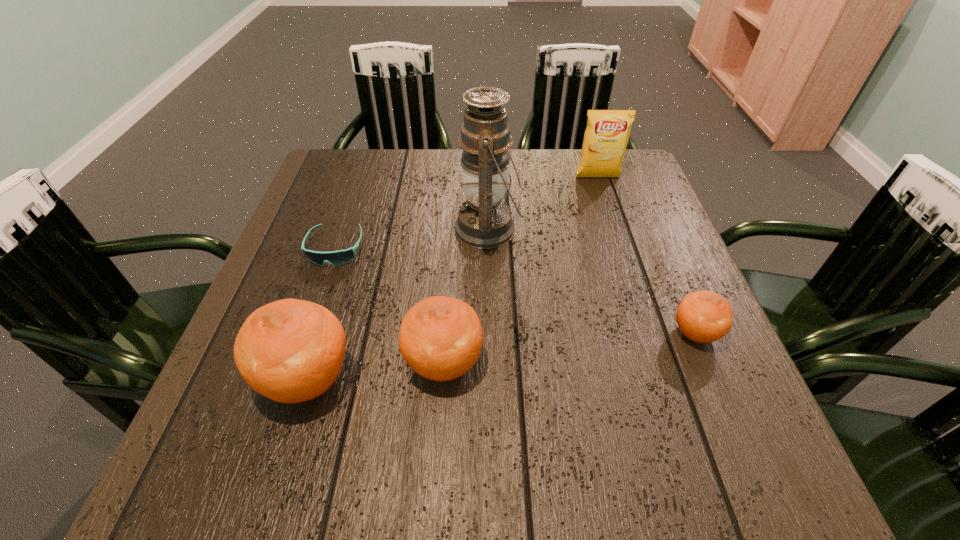
Find the location of a particular element. free location that satisfies the following two spatial constraints: 1. on the front-facing side of the leftmost orange; 2. on the right side of the shortest object is located at coordinates (291, 379).

Locate an element on the screen. free space that satisfies the following two spatial constraints: 1. on the front side of the rightmost orange; 2. on the left side of the tallest object is located at coordinates point(491,333).

I want to click on vacant point that satisfies the following two spatial constraints: 1. on the front side of the tallest object; 2. on the left side of the rightmost orange, so [x=491, y=333].